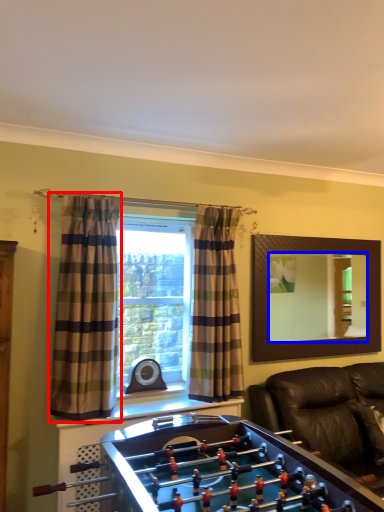
Question: Which object appears closest to the camera in this image, curtain (highlighted by a red box) or mirror (highlighted by a blue box)?

Choices:
 (A) curtain
 (B) mirror

Answer: (A)